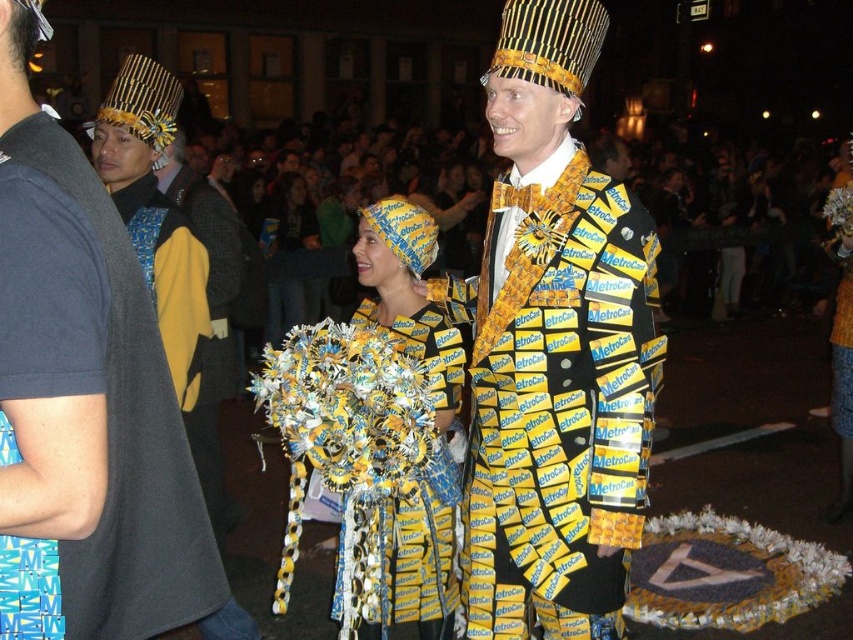
Does yellow paper bag at center have a lesser height compared to yellow paper at center?

Indeed, yellow paper bag at center has a lesser height compared to yellow paper at center.

Is point (74, 486) farther from camera compared to point (410, 195)?

That is False.

Find the location of a particular element. The width and height of the screenshot is (853, 640). yellow paper bag at center is located at coordinates (88, 388).

Is point (460, 192) closer to camera compared to point (276, 332)?

No.

Who is taller, yellow paper at center or yellow/yellow paper costume at center?

Standing taller between the two is yellow paper at center.

Locate an element on the screen. Image resolution: width=853 pixels, height=640 pixels. yellow paper at center is located at coordinates coord(741,236).

Locate an element on the screen. yellow paper at center is located at coordinates (741, 236).

You are a GUI agent. You are given a task and a screenshot of the screen. Output one action in this format:
    pyautogui.click(x=<x>, y=<y>)
    Task: Click on the yellow paper suit at center
    
    Given the screenshot: What is the action you would take?
    pyautogui.click(x=556, y=349)

Between point (579, 188) and point (390, 547), which one is positioned behind?

The point (390, 547) is more distant.

Identify the location of yellow paper suit at center. This screenshot has width=853, height=640. (556, 349).